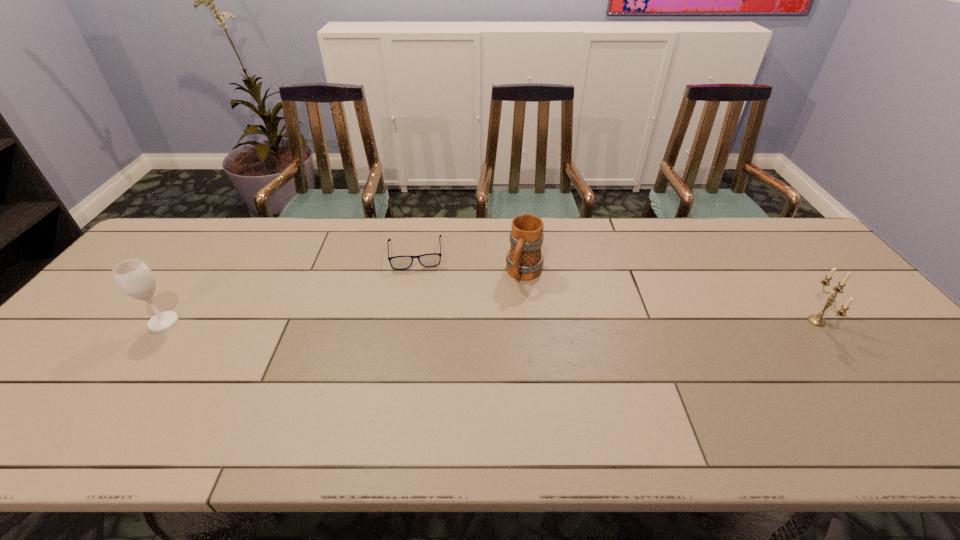
You are a GUI agent. You are given a task and a screenshot of the screen. Output one action in this format:
    pyautogui.click(x=<x>, y=<y>)
    Task: Click on the unoccupied position between the leftmost object and the candle
    Image resolution: width=960 pixels, height=540 pixels.
    Given the screenshot: What is the action you would take?
    pyautogui.click(x=491, y=322)

Identify the location of blank region between the mug and the wineglass. This screenshot has width=960, height=540. (345, 298).

The image size is (960, 540). Find the location of `object that ranks as the third closest to the second object from right to left`. object that ranks as the third closest to the second object from right to left is located at coordinates (134, 277).

This screenshot has width=960, height=540. I want to click on object that is the closest to the rightmost object, so click(x=524, y=261).

Identify the location of vacant region that satisfies the following two spatial constraints: 1. on the back side of the wineglass; 2. on the left side of the rightmost object. (165, 321).